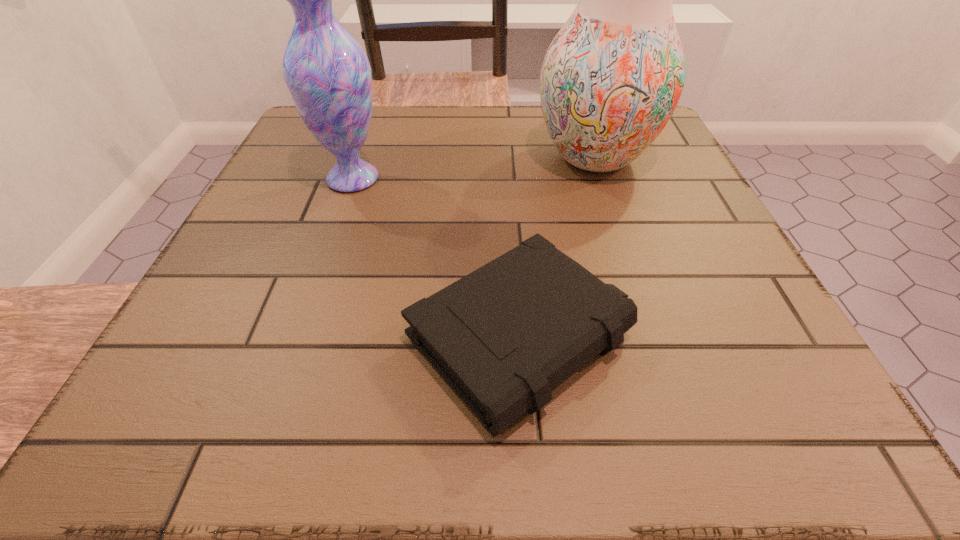
Where is `the right vase`? the right vase is located at coordinates (611, 79).

Identify the location of the leftmost object. This screenshot has height=540, width=960. (328, 75).

This screenshot has height=540, width=960. In order to click on the shortest object in this screenshot , I will do `click(505, 336)`.

Find the location of a particular element. The image size is (960, 540). the nearest object is located at coordinates (505, 336).

You are a GUI agent. You are given a task and a screenshot of the screen. Output one action in this format:
    pyautogui.click(x=<x>, y=<y>)
    Task: Click on the free spot located on the front of the right vase
    
    Given the screenshot: What is the action you would take?
    pyautogui.click(x=623, y=245)

The image size is (960, 540). In order to click on free space located on the back of the leftmost object in this screenshot , I will do `click(370, 130)`.

Where is `free spot located 0.070m on the left of the shortest object`? The height and width of the screenshot is (540, 960). free spot located 0.070m on the left of the shortest object is located at coordinates (356, 337).

The image size is (960, 540). I want to click on object present at the far edge, so click(x=611, y=79).

Locate an element on the screen. The image size is (960, 540). object that is positioned at the near edge is located at coordinates (505, 336).

Image resolution: width=960 pixels, height=540 pixels. I want to click on object that is at the left edge, so click(x=328, y=75).